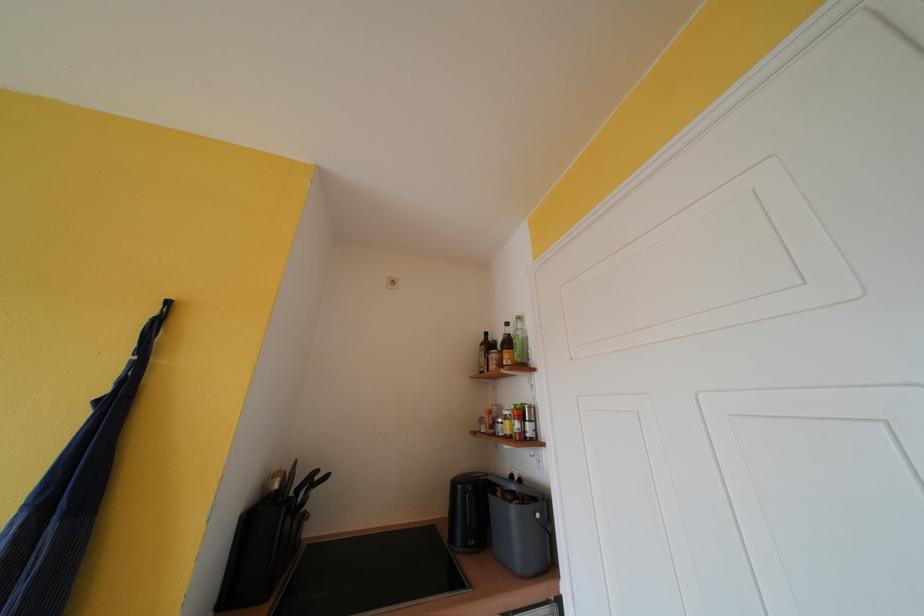
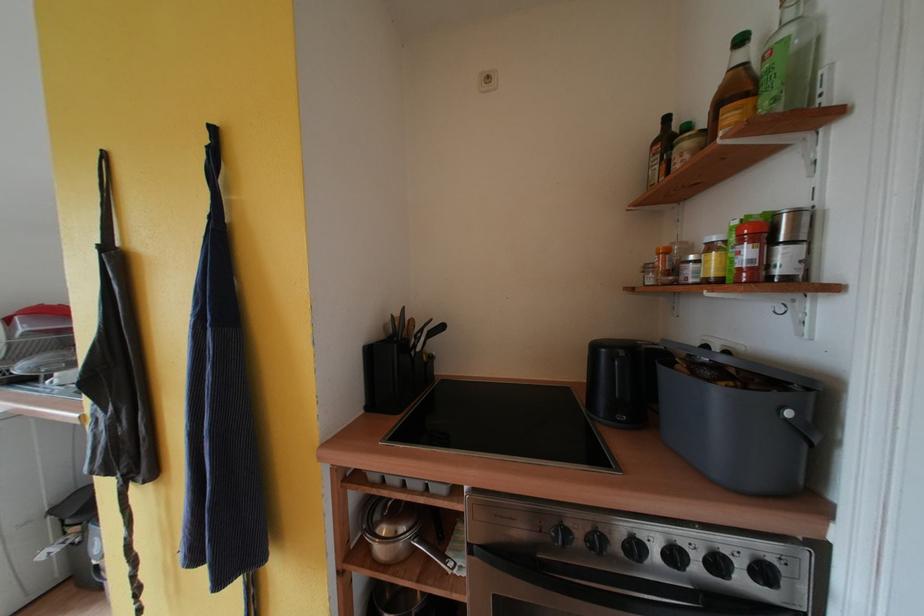
In the second image, find the point that corresponds to (518,513) in the first image.

(723, 397)